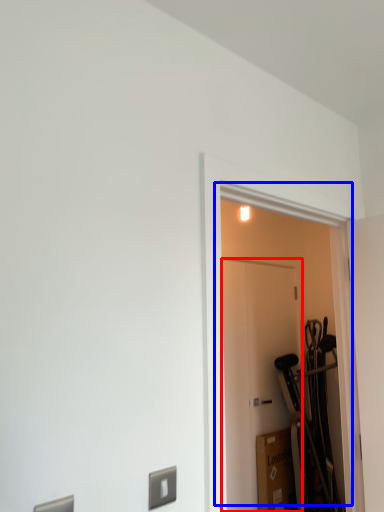
Question: Which point is further to the camera, door (highlighted by a red box) or door (highlighted by a blue box)?

Choices:
 (A) door
 (B) door

Answer: (A)